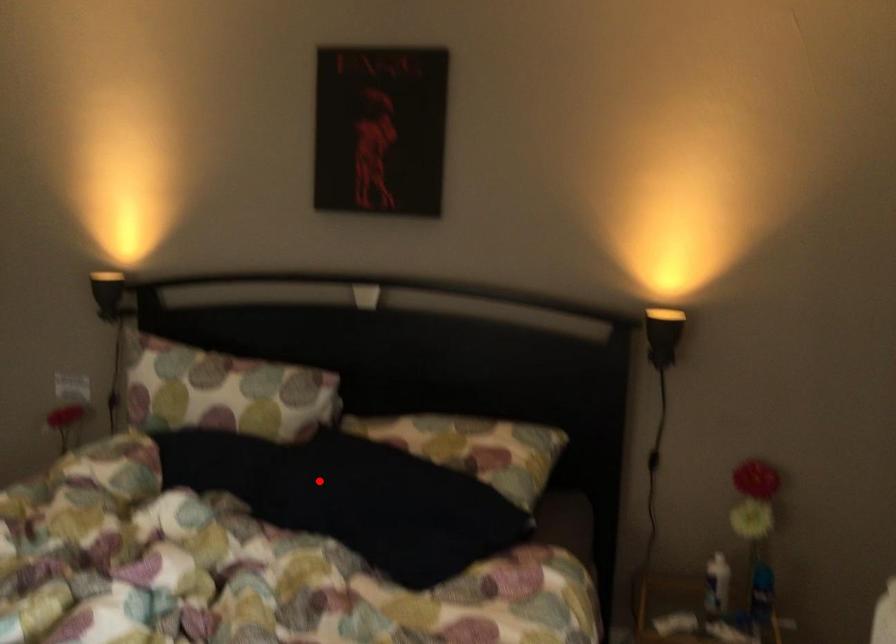
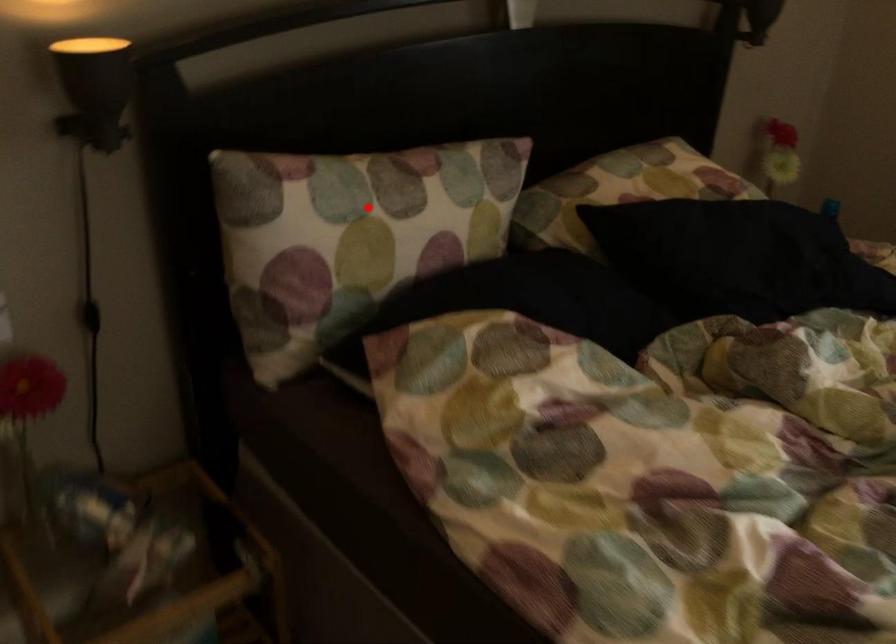
I am providing you with two images of the same scene from different viewpoints. A red point is marked on the first image and another point is marked on the second image. Is the red point in image1 aligned with the point shown in image2?

No